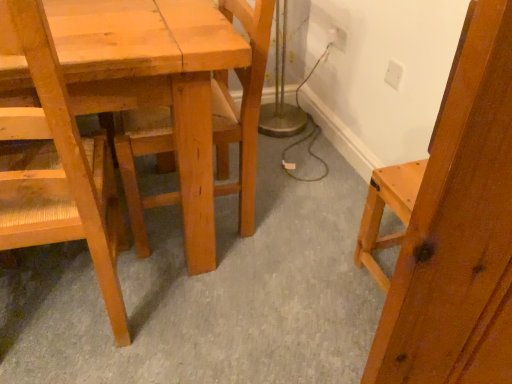
Where is `free point in front of natural wood chair at center, which is the second chair from left to right`? The height and width of the screenshot is (384, 512). free point in front of natural wood chair at center, which is the second chair from left to right is located at coordinates (210, 289).